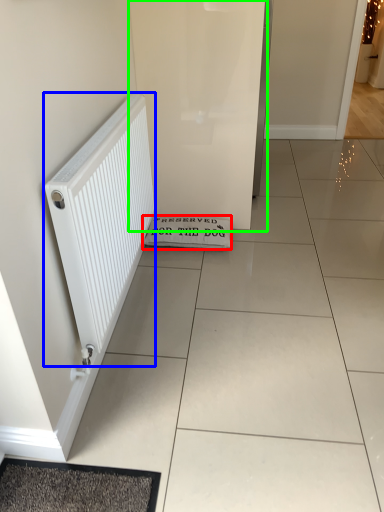
Question: Based on their relative distances, which object is farther from doormat (highlighted by a red box)? Choose from radiator (highlighted by a blue box) and screen door (highlighted by a green box).

Choices:
 (A) radiator
 (B) screen door

Answer: (A)